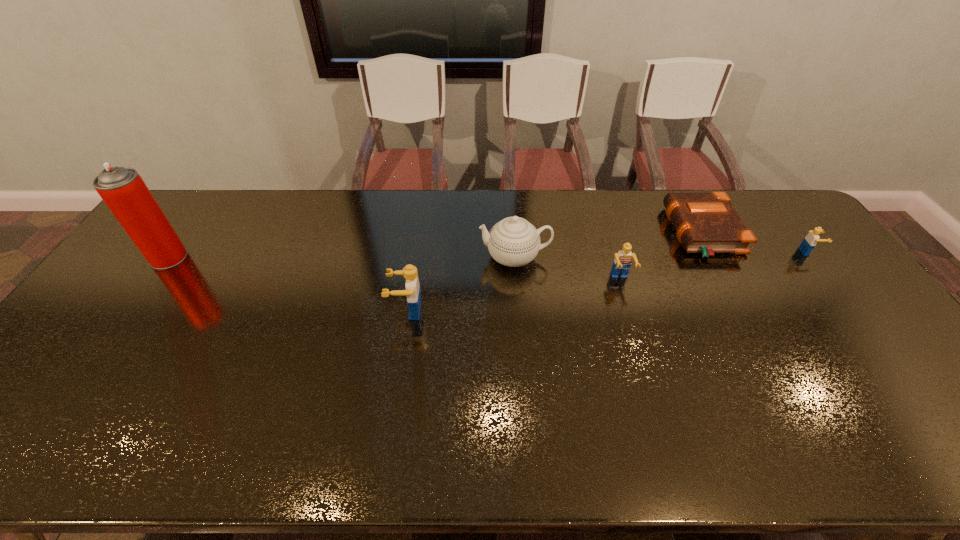
Where is `free space between the second tallest Lego and the fourth object from right to left`? The height and width of the screenshot is (540, 960). free space between the second tallest Lego and the fourth object from right to left is located at coordinates (567, 268).

Locate an element on the screen. Image resolution: width=960 pixels, height=540 pixels. free spot between the nearest object and the shortest object is located at coordinates 555,272.

Identify the location of free space that is in between the fifth tallest object and the leftmost object. The image size is (960, 540). (489, 255).

Identify the location of unoccupied area between the fourth object from left to right and the leftmost object. (395, 268).

Find the location of `free space between the rightmost Lego and the nearest Lego`. free space between the rightmost Lego and the nearest Lego is located at coordinates (608, 281).

In order to click on free area in between the second Lego from left to right and the fifth object from right to left in this screenshot , I will do `click(514, 295)`.

The width and height of the screenshot is (960, 540). Find the location of `free space between the second farthest Lego and the shortest Lego`. free space between the second farthest Lego and the shortest Lego is located at coordinates (714, 266).

At what (x,y) coordinates should I click in order to perform the action: click on free space between the second shortest object and the chinaware. Please return your answer as a coordinate pair (x, y). This screenshot has height=540, width=960. Looking at the image, I should click on (661, 254).

Identify the location of unoccupied position between the shortest Lego and the aerosol can. The image size is (960, 540). (489, 255).

The height and width of the screenshot is (540, 960). I want to click on empty space that is in between the tallest object and the shortest Lego, so click(x=489, y=255).